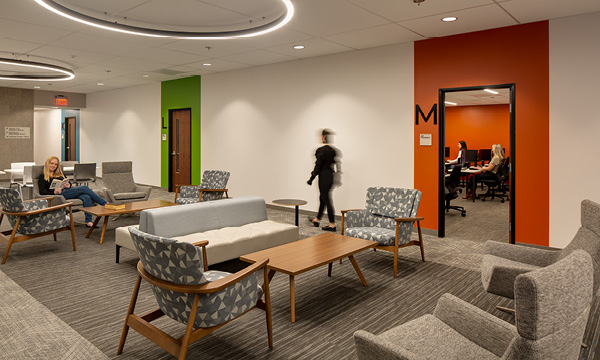
Find the location of `gray tones rug`. gray tones rug is located at coordinates (315, 334).